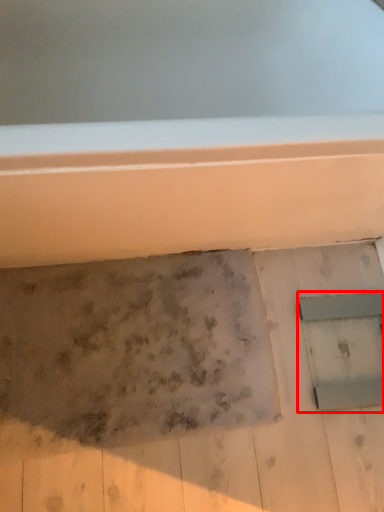
Question: Considering the relative positions of window (annotated by the red box) and footprint in the image provided, where is window (annotated by the red box) located with respect to the staircase?

Choices:
 (A) left
 (B) right

Answer: (B)